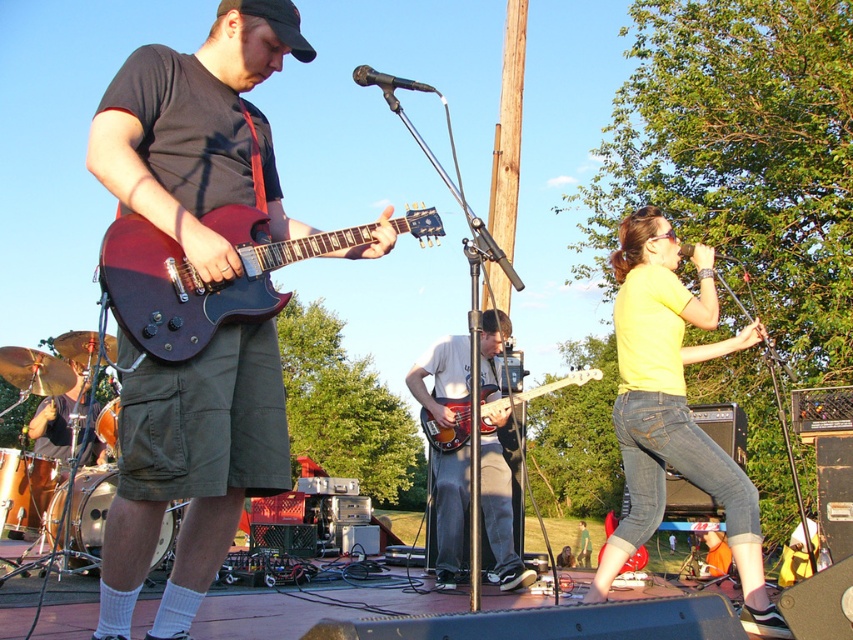
Question: Which point is closer to the camera taking this photo?

Choices:
 (A) (187, 376)
 (B) (416, 88)

Answer: (A)

Question: Among these objects, which one is farthest from the camera?

Choices:
 (A) matte black bass guitar at center
 (B) glossy wood bass at center
 (C) matte black guitar at center
 (D) glossy wood guitar at left

Answer: (A)

Question: Does matte black guitar at center appear on the left side of glossy wood bass at center?

Choices:
 (A) yes
 (B) no

Answer: (A)

Question: In this image, where is matte black guitar at center located relative to metallic silver microphone at upper right?

Choices:
 (A) above
 (B) below

Answer: (B)

Question: Is glossy wood bass at center closer to the viewer compared to metallic silver microphone at upper right?

Choices:
 (A) no
 (B) yes

Answer: (A)

Question: Which of these objects is positioned farthest from the glossy wood guitar at left?

Choices:
 (A) matte black guitar at center
 (B) yellow matte shirt at center
 (C) black metallic microphone at center
 (D) metallic silver microphone at upper right

Answer: (D)